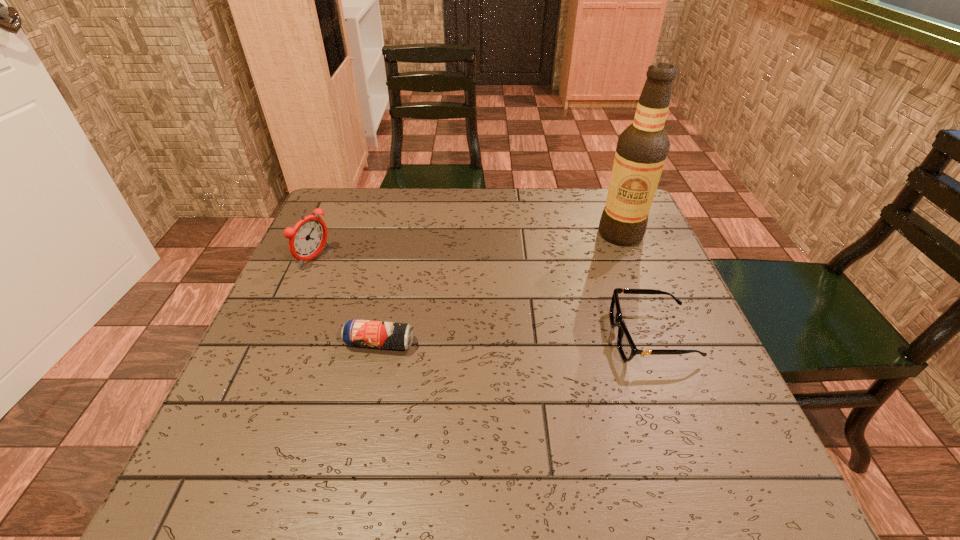
Locate an element on the screen. The width and height of the screenshot is (960, 540). free spot between the beer can and the sunglasses is located at coordinates (516, 340).

This screenshot has width=960, height=540. Find the location of `blank region between the tallest object and the alarm clock`. blank region between the tallest object and the alarm clock is located at coordinates tap(468, 246).

Identify the location of vacant area that lies between the second tallest object and the sunglasses. Image resolution: width=960 pixels, height=540 pixels. (483, 297).

Locate an element on the screen. Image resolution: width=960 pixels, height=540 pixels. free spot between the beer can and the alcohol is located at coordinates (500, 288).

What are the coordinates of `free space between the third shortest object and the second object from left to right` in the screenshot? It's located at (348, 300).

The width and height of the screenshot is (960, 540). I want to click on vacant area that lies between the alcohol and the second object from left to right, so click(500, 288).

Where is `object that is the nearest to the second object from left to right`? Image resolution: width=960 pixels, height=540 pixels. object that is the nearest to the second object from left to right is located at coordinates (308, 237).

The height and width of the screenshot is (540, 960). What are the coordinates of `the closest object to the beer can` in the screenshot? It's located at (308, 237).

Where is `vacant area that satisfies the following two spatial constraints: 1. on the back side of the beer can; 2. on the right side of the tallest object`? This screenshot has width=960, height=540. vacant area that satisfies the following two spatial constraints: 1. on the back side of the beer can; 2. on the right side of the tallest object is located at coordinates (x=403, y=234).

Where is `vacant position in the image that satisfies the following two spatial constraints: 1. on the front side of the leftmost object; 2. on the front-facing side of the sunglasses`? The height and width of the screenshot is (540, 960). vacant position in the image that satisfies the following two spatial constraints: 1. on the front side of the leftmost object; 2. on the front-facing side of the sunglasses is located at coordinates (280, 337).